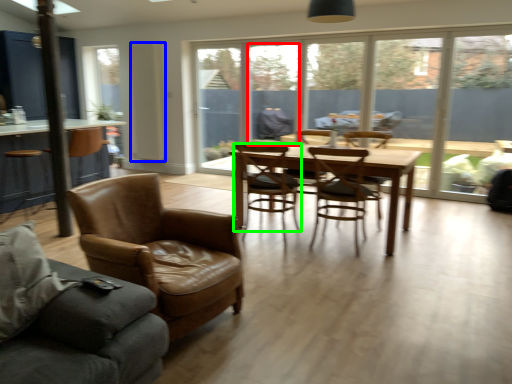
Question: Which object is positioned farthest from window (highlighted by a red box)? Select from screen door (highlighted by a blue box) and chair (highlighted by a green box).

Choices:
 (A) screen door
 (B) chair

Answer: (B)